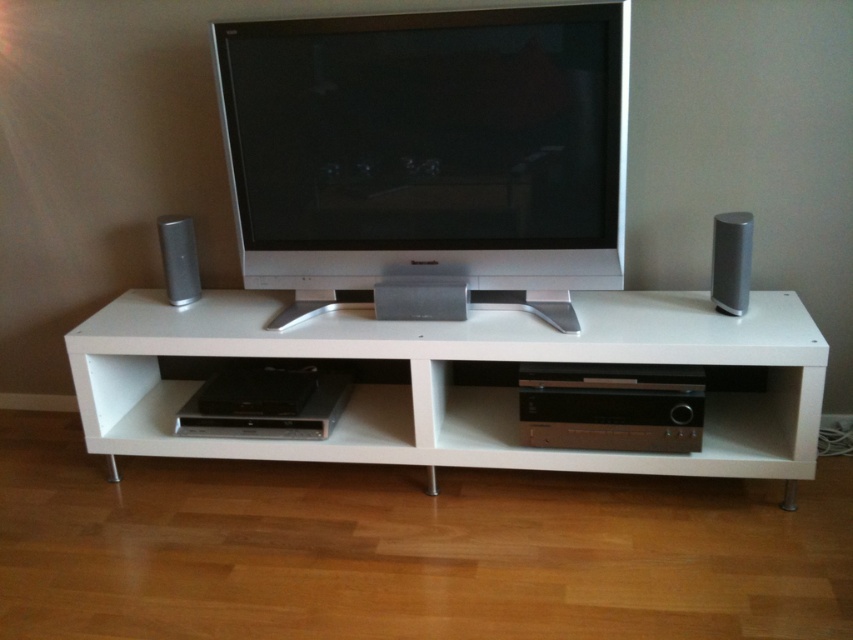
What do you see at coordinates (265, 403) in the screenshot? I see `black plastic stereo at lower center` at bounding box center [265, 403].

In the scene shown: Is black plastic stereo at lower center positioned at the back of satin silver speaker at center?

Yes, it is behind satin silver speaker at center.

Between point (196, 396) and point (428, 280), which one is positioned behind?

Point (196, 396)

You are a GUI agent. You are given a task and a screenshot of the screen. Output one action in this format:
    pyautogui.click(x=<x>, y=<y>)
    Task: Click on the black plastic stereo at lower center
    This screenshot has height=640, width=853.
    Given the screenshot: What is the action you would take?
    pyautogui.click(x=265, y=403)

Who is shorter, satin silver flat screen tv at center or white matte entertainment center at center?

With less height is white matte entertainment center at center.

Which is behind, point (280, 168) or point (432, 384)?

Point (280, 168)

Where is `satin silver flat screen tv at center`? The width and height of the screenshot is (853, 640). satin silver flat screen tv at center is located at coordinates (428, 150).

Is satin silver flat screen tv at center smaller than satin silver speaker at left?

No.

How much distance is there between satin silver flat screen tv at center and satin silver speaker at left?

satin silver flat screen tv at center and satin silver speaker at left are 23.89 inches apart from each other.

Who is more forward, (306,160) or (167,228)?

Point (306,160) is in front.

You are a GUI agent. You are given a task and a screenshot of the screen. Output one action in this format:
    pyautogui.click(x=<x>, y=<y>)
    Task: Click on the satin silver flat screen tv at center
    
    Given the screenshot: What is the action you would take?
    pyautogui.click(x=428, y=150)